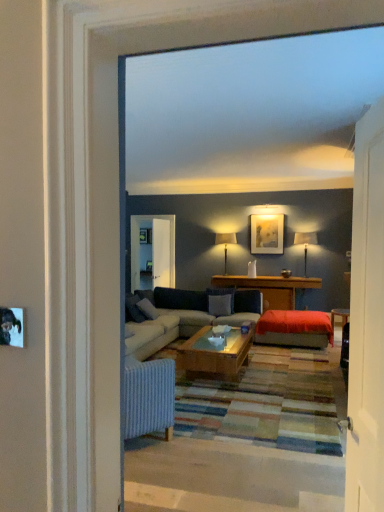
Question: Can you confirm if white wooden door at right is positioned to the left of clear glass screen door at center?

Choices:
 (A) yes
 (B) no

Answer: (B)

Question: From the image's perspective, is white wooden door at right on top of clear glass screen door at center?

Choices:
 (A) no
 (B) yes

Answer: (A)

Question: From a real-world perspective, is white wooden door at right physically below clear glass screen door at center?

Choices:
 (A) no
 (B) yes

Answer: (B)

Question: Is the position of white wooden door at right more distant than that of clear glass screen door at center?

Choices:
 (A) no
 (B) yes

Answer: (A)

Question: Considering the relative sizes of white wooden door at right and clear glass screen door at center in the image provided, is white wooden door at right bigger than clear glass screen door at center?

Choices:
 (A) no
 (B) yes

Answer: (A)

Question: Are white wooden door at right and clear glass screen door at center making contact?

Choices:
 (A) no
 (B) yes

Answer: (A)

Question: Is clear glass screen door at center facing towards wooden table at center?

Choices:
 (A) yes
 (B) no

Answer: (B)

Question: Can you confirm if clear glass screen door at center is positioned to the left of wooden table at center?

Choices:
 (A) no
 (B) yes

Answer: (B)

Question: From a real-world perspective, is clear glass screen door at center located higher than wooden table at center?

Choices:
 (A) yes
 (B) no

Answer: (A)

Question: Does clear glass screen door at center have a lesser height compared to wooden table at center?

Choices:
 (A) no
 (B) yes

Answer: (A)

Question: Does clear glass screen door at center have a greater width compared to wooden table at center?

Choices:
 (A) no
 (B) yes

Answer: (A)

Question: Considering the relative sizes of clear glass screen door at center and wooden table at center in the image provided, is clear glass screen door at center bigger than wooden table at center?

Choices:
 (A) no
 (B) yes

Answer: (A)

Question: Is matte gold picture frame at upper center beside wooden table at center?

Choices:
 (A) no
 (B) yes

Answer: (A)